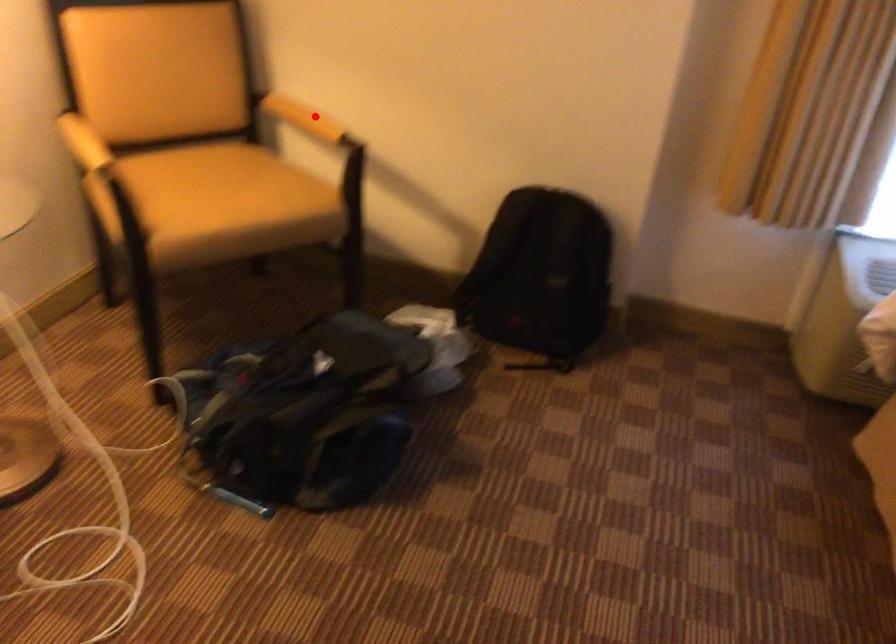
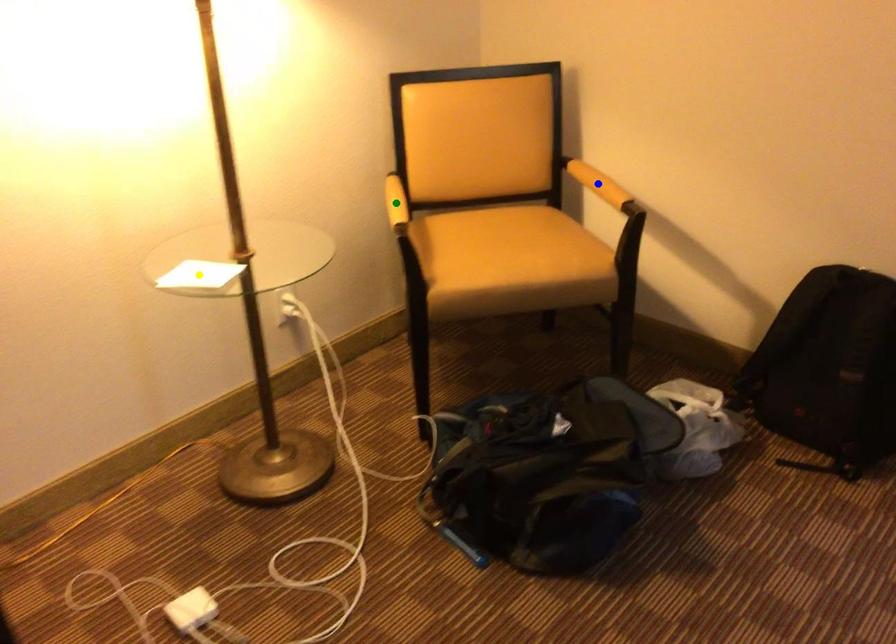
Question: I am providing you with two images of the same scene from different viewpoints. A red point is marked on the first image. You are given multiple points on the second image. Which mark in image 2 goes with the point in image 1?

Choices:
 (A) blue point
 (B) yellow point
 (C) green point

Answer: (A)